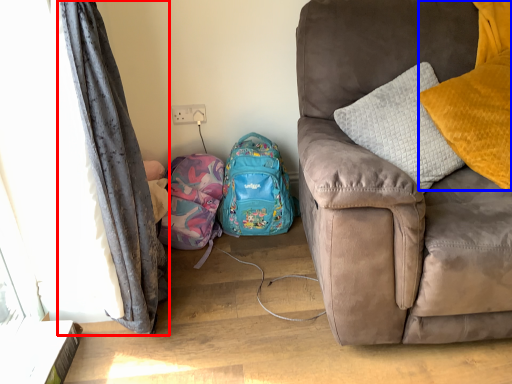
Question: Which of the following is the farthest to the observer, curtain (highlighted by a red box) or pillow (highlighted by a blue box)?

Choices:
 (A) curtain
 (B) pillow

Answer: (B)